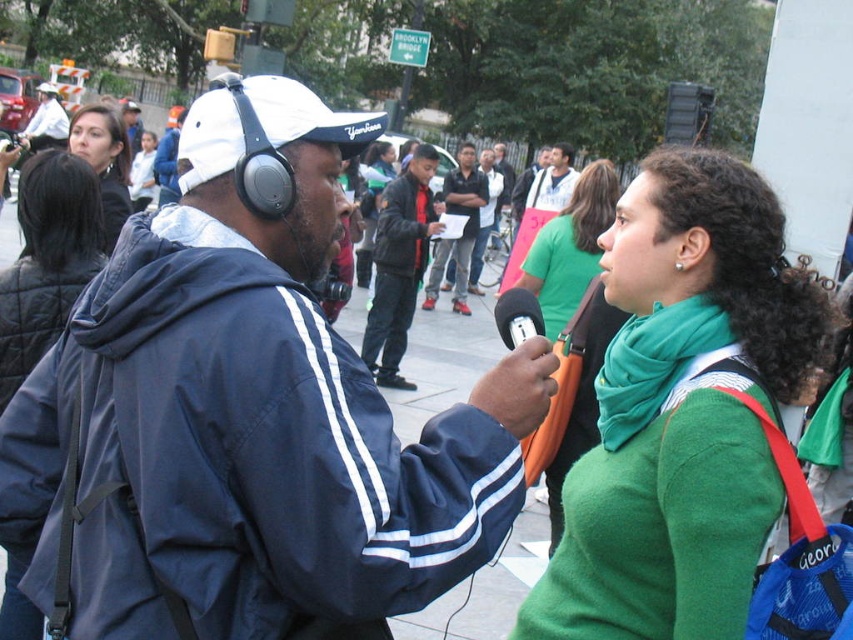
Question: Which object appears farthest from the camera in this image?

Choices:
 (A) green jersey at center
 (B) matte black jacket at upper left

Answer: (A)

Question: Which object is the closest to the green fuzzy sweater at center?

Choices:
 (A) dark blue jeans at center
 (B) matte black headphones at upper left

Answer: (B)

Question: Which object is the farthest from the green soft scarf at right?

Choices:
 (A) dark blue jacket at center
 (B) matte blue jacket at center

Answer: (A)

Question: Is green fuzzy sweater at center thinner than blue fabric jacket at center?

Choices:
 (A) no
 (B) yes

Answer: (B)

Question: Is matte black jacket at upper left closer to the viewer compared to matte black headphones at upper left?

Choices:
 (A) no
 (B) yes

Answer: (B)

Question: Is green knitted scarf at center wider than dark blue jeans at center?

Choices:
 (A) yes
 (B) no

Answer: (B)